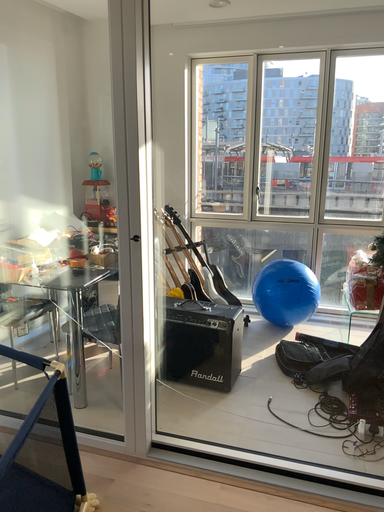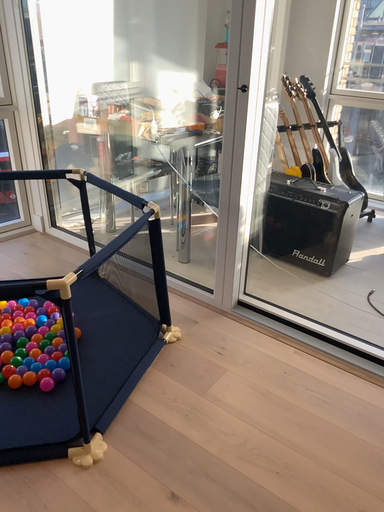
Question: Which way did the camera rotate in the video?

Choices:
 (A) rotated left
 (B) rotated right

Answer: (A)